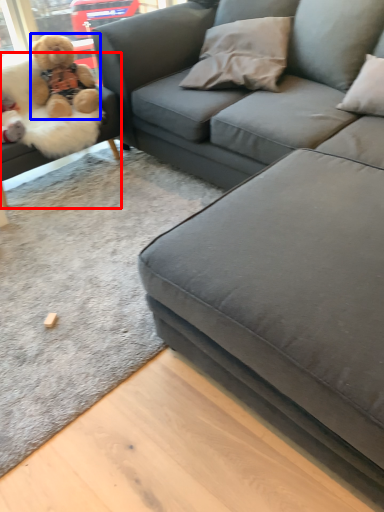
Question: Which of the following is the farthest to the observer, studio couch (highlighted by a red box) or teddy bear (highlighted by a blue box)?

Choices:
 (A) studio couch
 (B) teddy bear

Answer: (B)